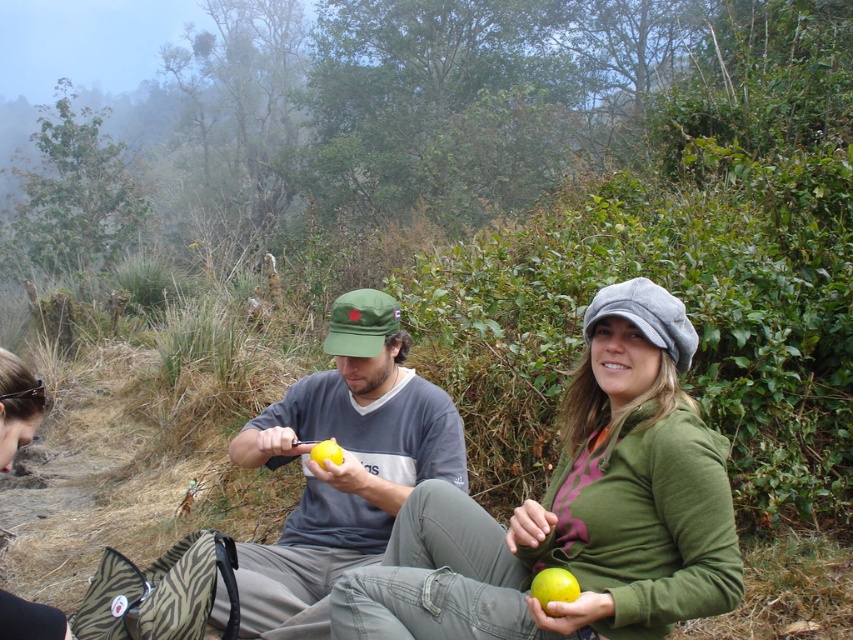
You are standing in the mountainous area and want to place a small flag at the point closer to the camera between point (283,416) and point (15,396). Which point should you choose?

You should choose point (283,416) because it is further to the camera than point (15,396).

You are a photographer trying to capture the scene. You notice the matte black hair at lower left and the yellow matte apple at center. Which object would appear larger in your photo?

A: The matte black hair at lower left is bigger than the yellow matte apple at center, so it would appear larger in the photo.

You are a photographer taking a picture of the matte black hair at lower left and the yellow matte apple at center. Which object will appear larger in the photo?

The matte black hair at lower left is closer to the viewer than the yellow matte apple at center, so it will appear larger in the photo.